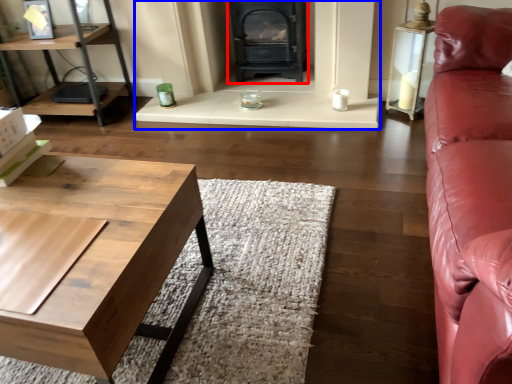
Question: Among these objects, which one is nearest to the camera, wood burning stove (highlighted by a red box) or fireplace (highlighted by a blue box)?

Choices:
 (A) wood burning stove
 (B) fireplace

Answer: (B)